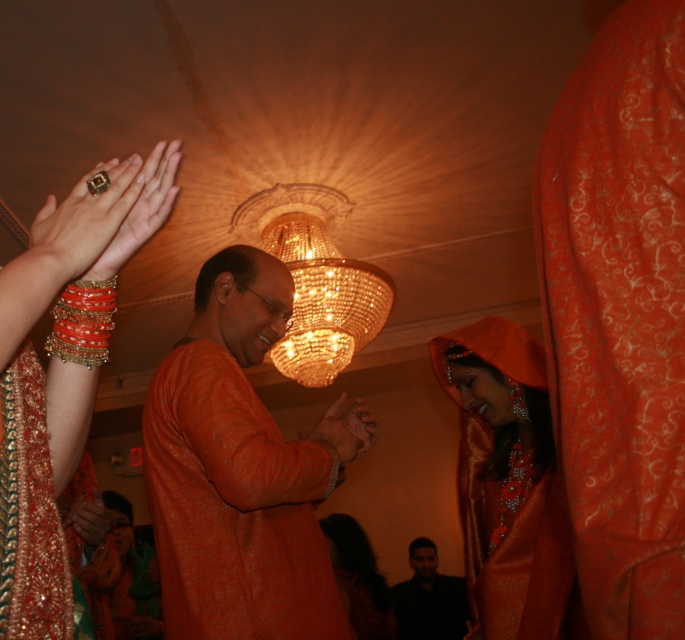
You are a photographer trying to capture the main subject in the image. According to the scene, which object is positioned closer to you, the orange silk kurta at center or the matte orange hand at center?

The orange silk kurta at center is closer to the viewer than the matte orange hand at center.

You are standing in the festive indoor scene and want to place a small decoration exactly at the point marked as point [160,547]. If you extend your arm fully, which is 1.2 meters long, can you reach that point?

The point [160,547] is 1.32 meters away from you. Since your arm is only 1.2 meters long, you cannot reach it with your arm fully extended.